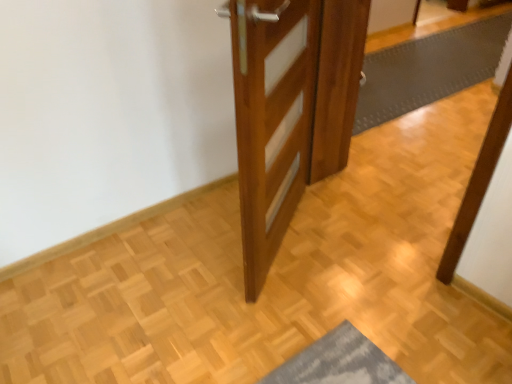
Locate an element on the screen. The width and height of the screenshot is (512, 384). wooden door at center is located at coordinates (290, 109).

Image resolution: width=512 pixels, height=384 pixels. What do you see at coordinates (290, 109) in the screenshot?
I see `wooden door at center` at bounding box center [290, 109].

This screenshot has width=512, height=384. What do you see at coordinates (429, 69) in the screenshot?
I see `gray rubber bath mat at center` at bounding box center [429, 69].

What are the coordinates of `gray rubber bath mat at center` in the screenshot? It's located at (429, 69).

What is the approximate width of gray rubber bath mat at center?

It is 12.04 feet.

In order to face gray rubber bath mat at center, should I rotate leftwards or rightwards?

It's best to rotate right around 25.278 degrees.

Where is `wooden door at center`? Image resolution: width=512 pixels, height=384 pixels. wooden door at center is located at coordinates click(290, 109).

Does gray rubber bath mat at center appear on the right side of wooden door at center?

Yes.

Does gray rubber bath mat at center come behind wooden door at center?

That is True.

Does point (441, 63) come behind point (298, 106)?

That is True.

Consider the image. From the image's perspective, which one is positioned lower, gray rubber bath mat at center or wooden door at center?

From the image's view, wooden door at center is below.

From a real-world perspective, between gray rubber bath mat at center and wooden door at center, who is vertically higher?

wooden door at center.

In terms of width, does gray rubber bath mat at center look wider or thinner when compared to wooden door at center?

Considering their sizes, gray rubber bath mat at center looks broader than wooden door at center.

Considering the sizes of gray rubber bath mat at center and wooden door at center in the image, is gray rubber bath mat at center taller or shorter than wooden door at center?

gray rubber bath mat at center is shorter than wooden door at center.

Is gray rubber bath mat at center smaller than wooden door at center?

Actually, gray rubber bath mat at center might be larger than wooden door at center.

Can wooden door at center be found inside gray rubber bath mat at center?

No, gray rubber bath mat at center does not contain wooden door at center.

Is gray rubber bath mat at center not near wooden door at center?

gray rubber bath mat at center is positioned a significant distance from wooden door at center.

Is wooden door at center at the back of gray rubber bath mat at center?

No, wooden door at center is not at the back of gray rubber bath mat at center.

Measure the distance from gray rubber bath mat at center to wooden door at center.

The distance of gray rubber bath mat at center from wooden door at center is 4.49 feet.

Locate an element on the screen. This screenshot has height=384, width=512. bath mat behind the wooden door at center is located at coordinates (429, 69).

Considering the positions of objects wooden door at center and gray rubber bath mat at center in the image provided, who is more to the right, wooden door at center or gray rubber bath mat at center?

gray rubber bath mat at center.

Which object is closer to the camera taking this photo, wooden door at center or gray rubber bath mat at center?

wooden door at center is closer to the camera.

Does point (344, 79) come behind point (430, 49)?

No.

From the image's perspective, between wooden door at center and gray rubber bath mat at center, who is located below?

From the image's view, wooden door at center is below.

From a real-world perspective, which object rests below the other?

From a 3D spatial view, gray rubber bath mat at center is below.

Is wooden door at center thinner than gray rubber bath mat at center?

Yes.

Considering the relative sizes of wooden door at center and gray rubber bath mat at center in the image provided, is wooden door at center shorter than gray rubber bath mat at center?

Incorrect, the height of wooden door at center does not fall short of that of gray rubber bath mat at center.

Which of these two, wooden door at center or gray rubber bath mat at center, is bigger?

With larger size is gray rubber bath mat at center.

Is wooden door at center positioned beyond the bounds of gray rubber bath mat at center?

wooden door at center is positioned outside gray rubber bath mat at center.

Is wooden door at center touching gray rubber bath mat at center?

No, wooden door at center is not next to gray rubber bath mat at center.

Looking at this image, could you tell me if wooden door at center is turned towards gray rubber bath mat at center?

No, wooden door at center is not facing towards gray rubber bath mat at center.

How much distance is there between wooden door at center and gray rubber bath mat at center?

wooden door at center is 1.37 meters away from gray rubber bath mat at center.

Locate an element on the screen. door lying below the gray rubber bath mat at center (from the image's perspective) is located at coordinates (290, 109).

Where is `bath mat that appears behind the wooden door at center`? The width and height of the screenshot is (512, 384). bath mat that appears behind the wooden door at center is located at coordinates (429, 69).

In order to click on door above the gray rubber bath mat at center (from a real-world perspective) in this screenshot , I will do `click(290, 109)`.